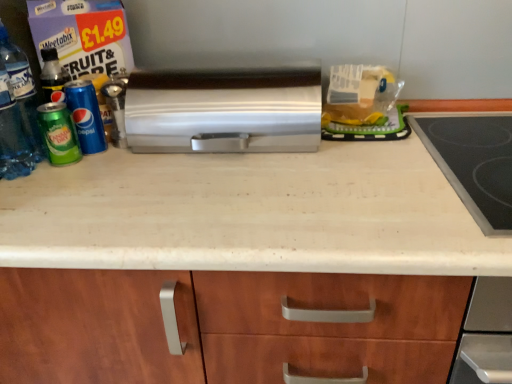
Where is `vacant space to the right of satin silver toaster at center`? vacant space to the right of satin silver toaster at center is located at coordinates (407, 157).